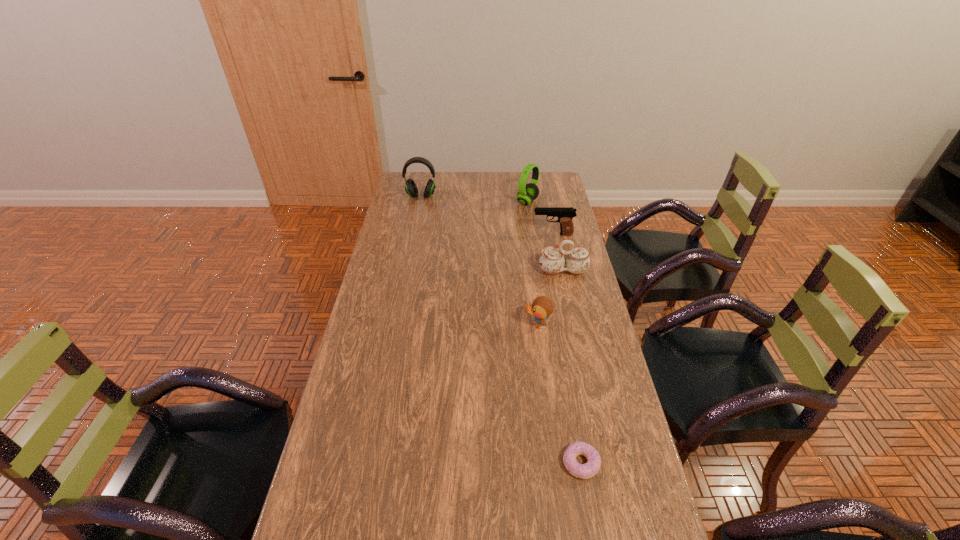
Find the location of a particular element. pistol located at the right edge is located at coordinates (565, 215).

The width and height of the screenshot is (960, 540). Find the location of `doughnut that is positioned at the right edge`. doughnut that is positioned at the right edge is located at coordinates (583, 471).

The height and width of the screenshot is (540, 960). In order to click on object present at the far left corner in this screenshot , I will do `click(411, 189)`.

Where is `object at the far right corner`? object at the far right corner is located at coordinates (527, 193).

Identify the location of free space at the far edge of the desktop. The image size is (960, 540). (494, 177).

Locate an element on the screen. This screenshot has height=540, width=960. vacant space at the left edge of the desktop is located at coordinates (359, 341).

The width and height of the screenshot is (960, 540). In the image, there is a desktop. In order to click on free space at the right edge in this screenshot , I will do `click(564, 198)`.

I want to click on unoccupied position between the nearest object and the chinaware, so click(x=572, y=367).

At what (x,y) coordinates should I click in order to perform the action: click on vacant space that is in between the right headset and the fifth farthest object. Please return your answer as a coordinate pair (x, y). Looking at the image, I should click on (533, 263).

In order to click on free space between the shortest object and the second nearest object in this screenshot , I will do `click(559, 394)`.